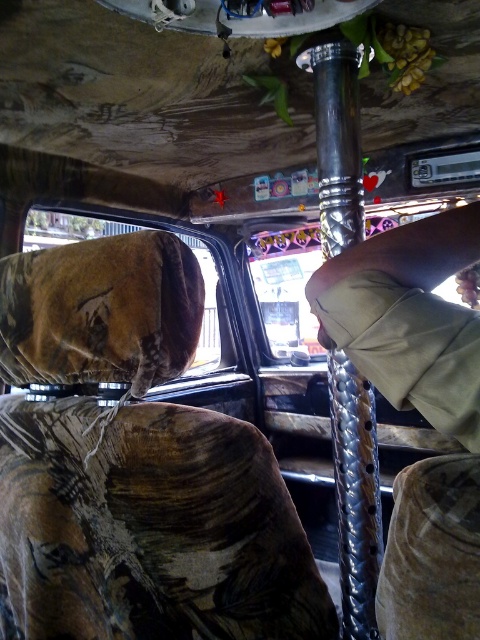
Question: Which object is the farthest from the camouflage fabric car window at upper left?

Choices:
 (A) metallic silver pole at center
 (B) polished metal pole at center
 (C) transparent plastic window at center

Answer: (B)

Question: Which object is closer to the camera taking this photo?

Choices:
 (A) camouflage fabric car window at upper left
 (B) polished metal pole at center
 (C) transparent plastic window at center

Answer: (C)

Question: Observing the image, what is the correct spatial positioning of polished metal pole at center in reference to transparent plastic window at center?

Choices:
 (A) below
 (B) above

Answer: (A)

Question: Does polished metal pole at center have a greater width compared to camouflage fabric car window at upper left?

Choices:
 (A) no
 (B) yes

Answer: (A)

Question: Which of the following is the closest to the observer?

Choices:
 (A) transparent plastic window at center
 (B) polished metal pole at center

Answer: (A)

Question: Is transparent plastic window at center above camouflage fabric car window at upper left?

Choices:
 (A) no
 (B) yes

Answer: (A)